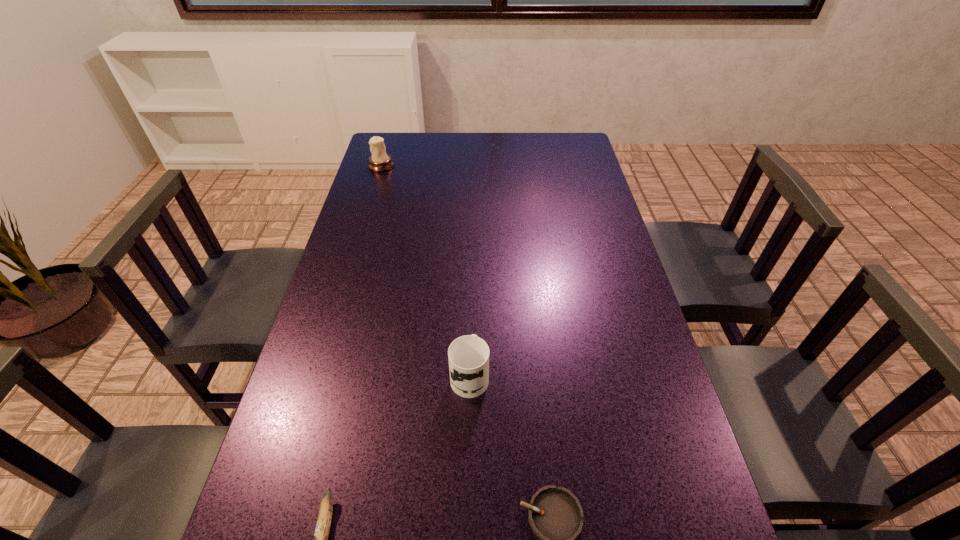
Identify the location of object present at the far left corner. (380, 161).

I want to click on free spot at the far edge of the desktop, so click(449, 136).

Find the location of `free space at the left edge`. free space at the left edge is located at coordinates (383, 259).

In the image, there is a desktop. Where is `free space at the right edge`? The image size is (960, 540). free space at the right edge is located at coordinates (602, 243).

Where is `free point between the leftmost object and the third object from left to right`? This screenshot has width=960, height=540. free point between the leftmost object and the third object from left to right is located at coordinates (425, 270).

This screenshot has height=540, width=960. Find the location of `free spot between the candle holder and the second object from right to left`. free spot between the candle holder and the second object from right to left is located at coordinates (425, 270).

The image size is (960, 540). I want to click on vacant space that is in between the third object from left to right and the candle holder, so click(425, 270).

Select which object is the second closest to the third object from left to right. Please provide its 2D coordinates. Your answer should be formatted as a tuple, i.e. [(x, y)], where the tuple contains the x and y coordinates of a point satisfying the conditions above.

[(320, 539)]

Locate an element on the screen. The height and width of the screenshot is (540, 960). object that is the second closest one to the third tallest object is located at coordinates (555, 514).